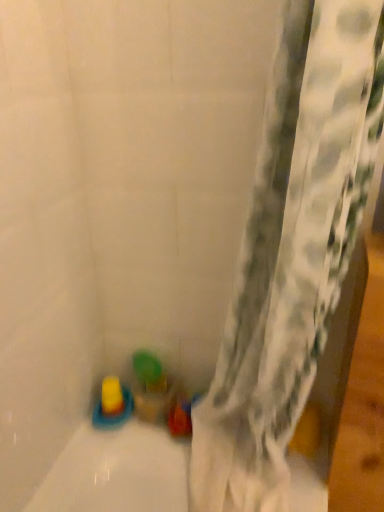
Question: Based on their sizes in the image, would you say yellow rubber toy at lower left, marked as the 3th toy in a right-to-left arrangement, is bigger or smaller than translucent plastic cup at lower center, positioned as the first toy in right-to-left order?

Choices:
 (A) big
 (B) small

Answer: (B)

Question: From the image's perspective, relative to translucent plastic cup at lower center, positioned as the first toy in right-to-left order, is yellow rubber toy at lower left, arranged as the first toy when viewed from the left, above or below?

Choices:
 (A) below
 (B) above

Answer: (B)

Question: Which object is positioned closest to the translucent yellow toy at bottom left, which is counted as the second toy, starting from the left?

Choices:
 (A) translucent plastic cup at lower center, the third toy from the left
 (B) yellow rubber toy at lower left, marked as the 3th toy in a right-to-left arrangement

Answer: (B)

Question: Which object is the closest to the translucent yellow toy at bottom left, which is counted as the second toy, starting from the left?

Choices:
 (A) yellow rubber toy at lower left, arranged as the first toy when viewed from the left
 (B) translucent plastic cup at lower center, the third toy from the left

Answer: (A)